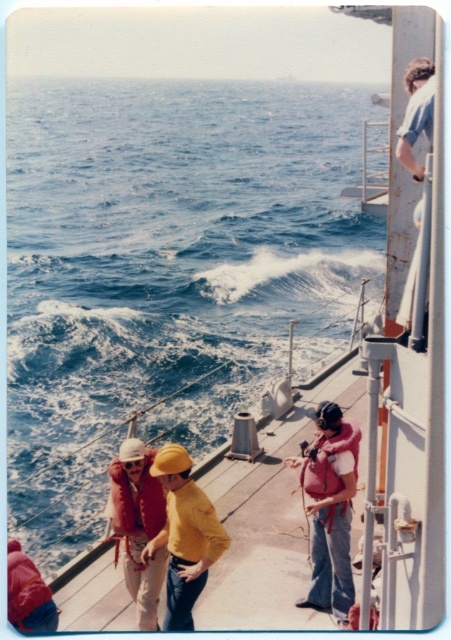
Is point (141, 449) positioned before point (142, 522)?

Yes, it is.

Does red life vest at lower left appear under matte red life jacket at center?

Yes, red life vest at lower left is below matte red life jacket at center.

Is point (120, 461) closer to viewer compared to point (134, 531)?

Yes, it is in front of point (134, 531).

Identify the location of red life vest at lower left. (138, 525).

Locate an element on the screen. The height and width of the screenshot is (640, 451). matte red life jacket at center is located at coordinates click(x=137, y=500).

Does point (115, 513) lie behind point (340, 451)?

No, it is in front of (340, 451).

This screenshot has width=451, height=640. In order to click on matte red life jacket at center in this screenshot , I will do pos(137,500).

Can you confirm if yellow matte sweater at center is bigger than matte pink life jacket at center?

Yes.

Can you confirm if yellow matte sweater at center is positioned above matte pink life jacket at center?

Incorrect, yellow matte sweater at center is not positioned above matte pink life jacket at center.

What do you see at coordinates (184, 536) in the screenshot? I see `yellow matte sweater at center` at bounding box center [184, 536].

I want to click on yellow matte sweater at center, so click(184, 536).